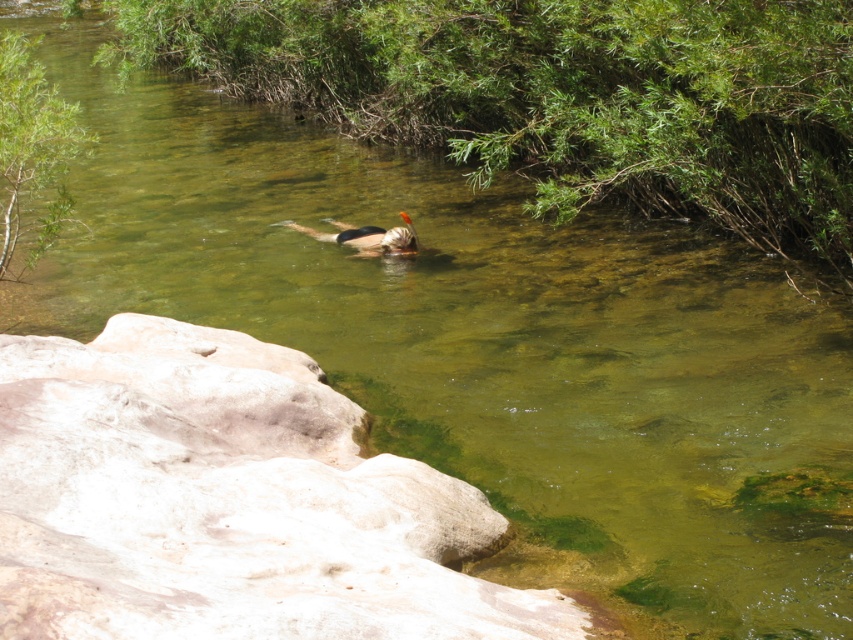
Question: Which point is farther from the camera taking this photo?

Choices:
 (A) (357, 232)
 (B) (643, 97)

Answer: (A)

Question: Which point appears farthest from the camera in this image?

Choices:
 (A) (195, 51)
 (B) (329, 237)

Answer: (A)

Question: Can you confirm if white rock at lower left is positioned to the left of smooth brown man at center?

Choices:
 (A) yes
 (B) no

Answer: (B)

Question: Which object is positioned farthest from the white rock at lower left?

Choices:
 (A) green leafy bush at upper center
 (B) green leafy bush at upper left
 (C) smooth brown man at center

Answer: (A)

Question: Is white rock at lower left smaller than green leafy bush at upper left?

Choices:
 (A) no
 (B) yes

Answer: (B)

Question: Does white rock at lower left appear on the right side of green leafy bush at upper left?

Choices:
 (A) yes
 (B) no

Answer: (A)